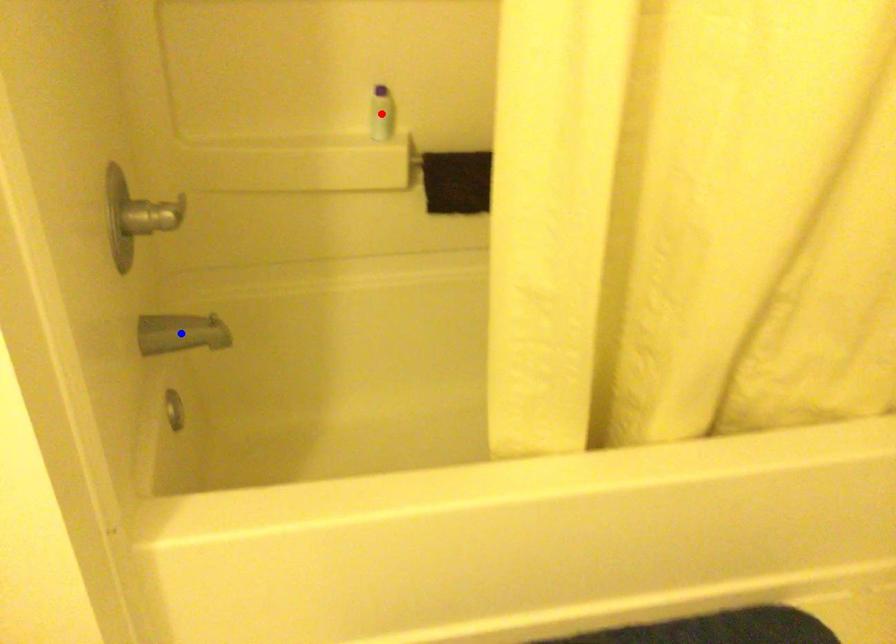
Question: In the image, two points are highlighted. Which point is nearer to the camera? Reply with the corresponding letter.

Choices:
 (A) blue point
 (B) red point

Answer: (A)